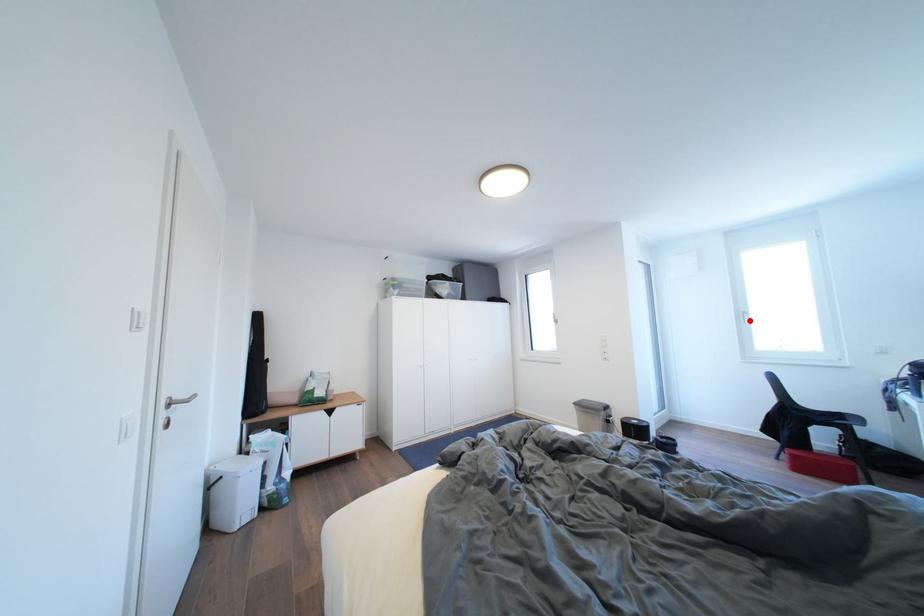
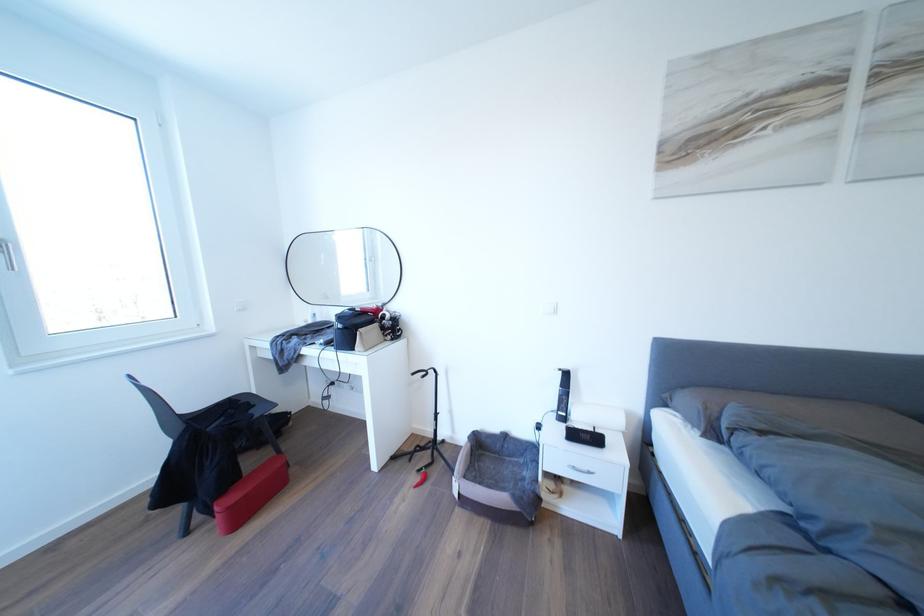
Locate, in the second image, the point that corresponds to the highlighted location in the first image.

(6, 254)